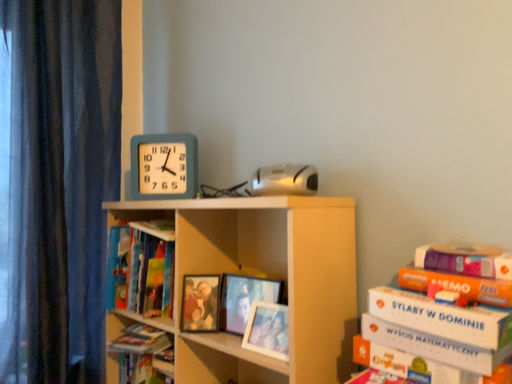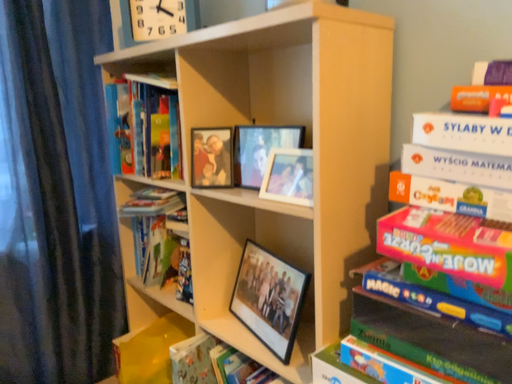
Question: How did the camera likely rotate when shooting the video?

Choices:
 (A) rotated downward
 (B) rotated upward

Answer: (A)